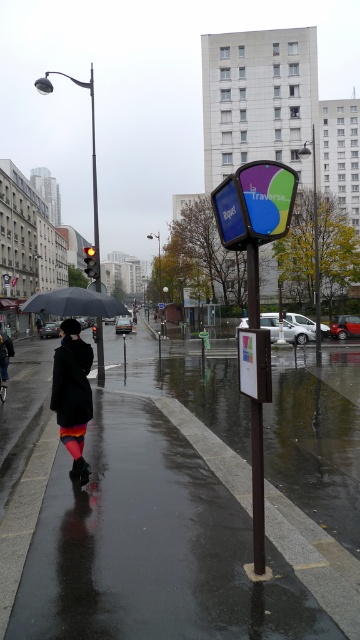
Question: Does shiny asphalt pavement at center appear on the right side of rainbow knit skirt at lower left?

Choices:
 (A) yes
 (B) no

Answer: (A)

Question: Which point is farther from the camera taking this photo?

Choices:
 (A) (62, 426)
 (B) (102, 307)
 (C) (357, 556)

Answer: (B)

Question: Does shiny asphalt pavement at center appear on the left side of black matte umbrella at left?

Choices:
 (A) no
 (B) yes

Answer: (A)

Question: Which point appears closest to the camera in this image?

Choices:
 (A) (15, 634)
 (B) (92, 300)
 (C) (57, 348)

Answer: (A)

Question: Can you confirm if shiny asphalt pavement at center is positioned to the right of black matte umbrella at left?

Choices:
 (A) yes
 (B) no

Answer: (A)

Question: Which is nearer to the rainbow knit skirt at lower left?

Choices:
 (A) black matte umbrella at left
 (B) shiny asphalt pavement at center

Answer: (A)